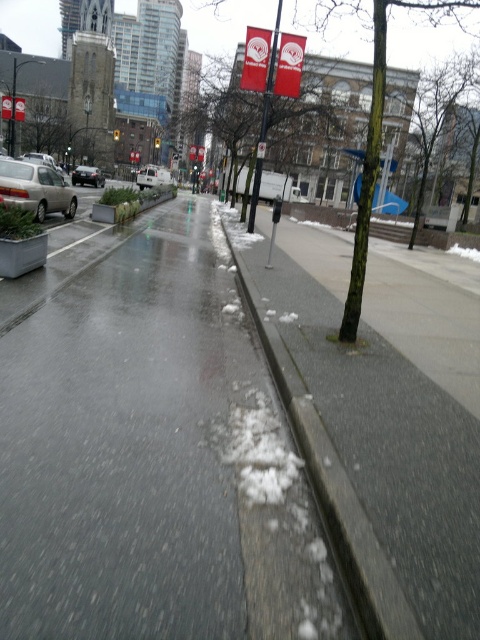
Question: Is gray asphalt pavement at center in front of gray concrete curb at lower center?

Choices:
 (A) yes
 (B) no

Answer: (B)

Question: Among these objects, which one is farthest from the camera?

Choices:
 (A) white matte van at center
 (B) gray concrete curb at lower center
 (C) gray asphalt pavement at center
 (D) shiny silver sedan at center

Answer: (A)

Question: Which point is farther to the camera?

Choices:
 (A) gray concrete curb at lower center
 (B) gray asphalt pavement at center

Answer: (B)

Question: Observing the image, what is the correct spatial positioning of silver metallic sedan at left in reference to shiny silver sedan at center?

Choices:
 (A) left
 (B) right

Answer: (B)

Question: Which point is closer to the camera?

Choices:
 (A) gray asphalt pavement at center
 (B) silver metallic sedan at left
 (C) white matte van at center

Answer: (A)

Question: Is white matte van at center to the left of shiny silver sedan at center from the viewer's perspective?

Choices:
 (A) no
 (B) yes

Answer: (A)